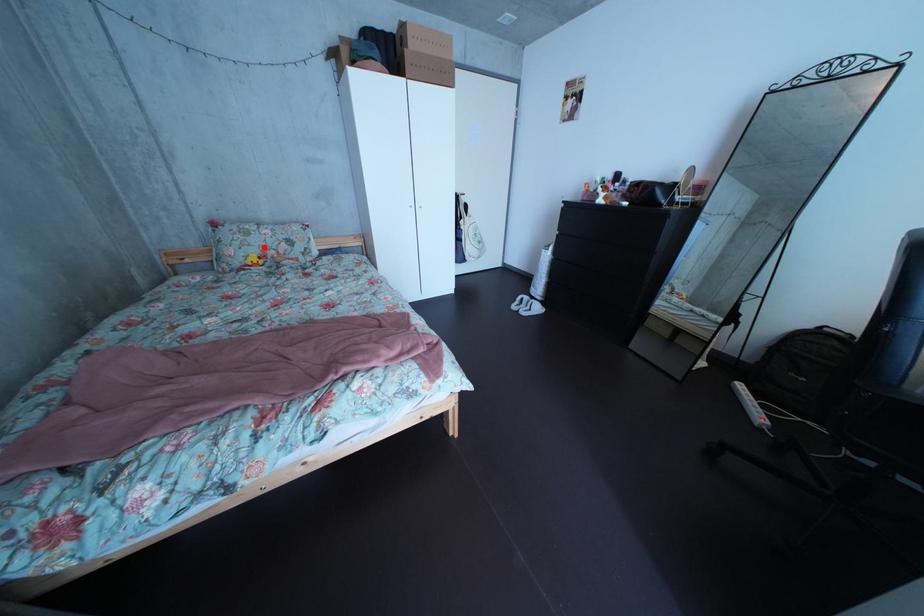
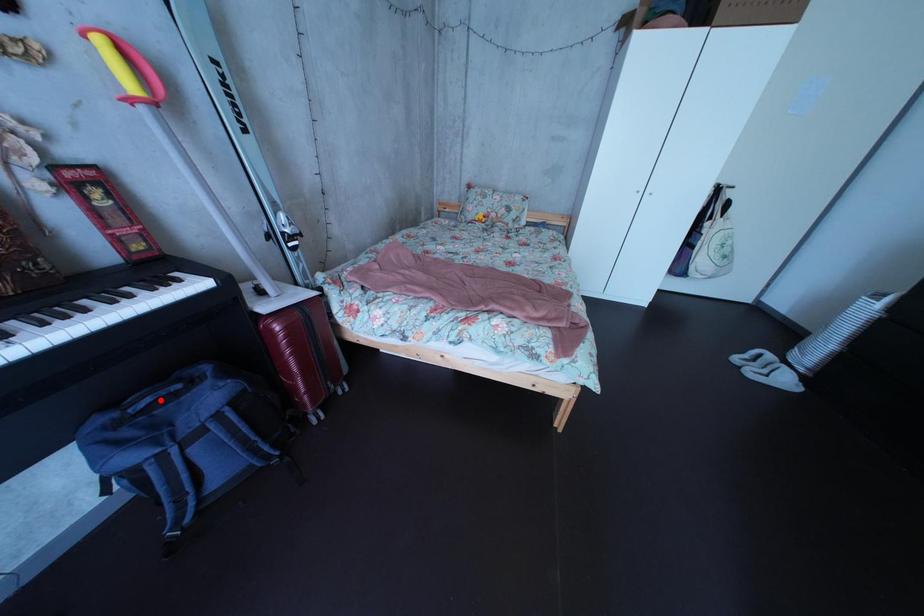
I am providing you with two images of the same scene from different viewpoints. A red point is marked on the first image and another point is marked on the second image. Do the highlighted points in image1 and image2 indicate the same real-world spot?

No